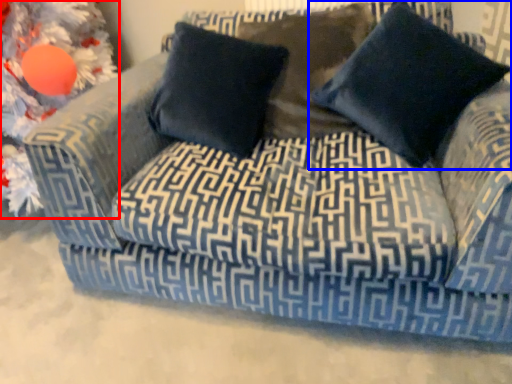
Question: Which object is further to the camera taking this photo, christmas decoration (highlighted by a red box) or pillow (highlighted by a blue box)?

Choices:
 (A) christmas decoration
 (B) pillow

Answer: (A)